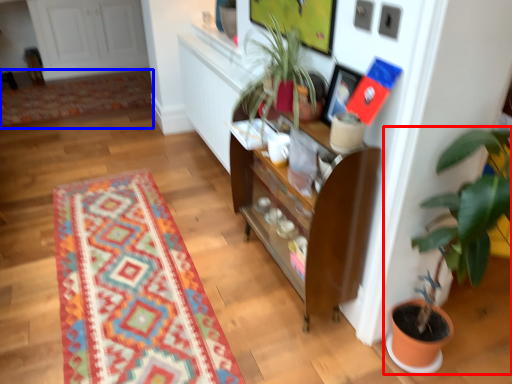
Question: Which point is further to the camera, houseplant (highlighted by a red box) or mat (highlighted by a blue box)?

Choices:
 (A) houseplant
 (B) mat

Answer: (B)